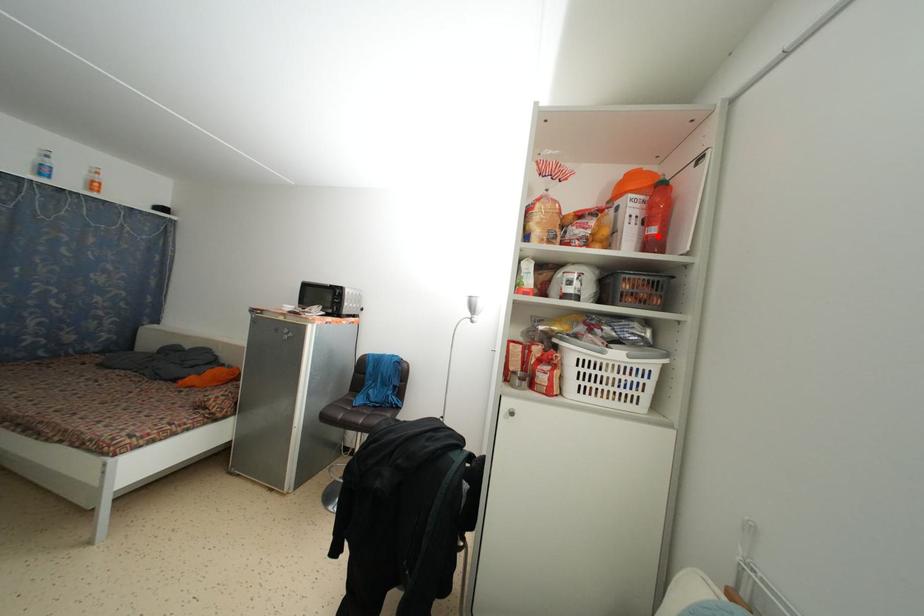
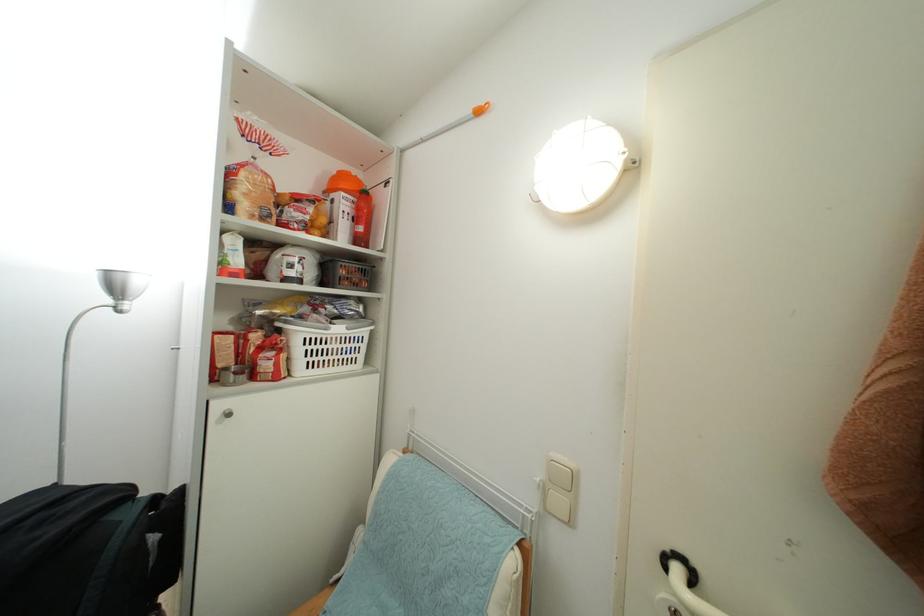
The point at the highlighted location is marked in the first image. Where is the corresponding point in the second image?

(365, 235)